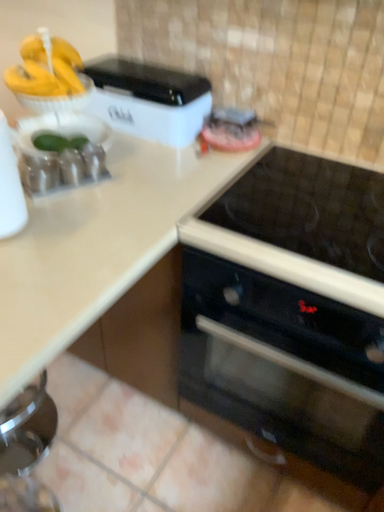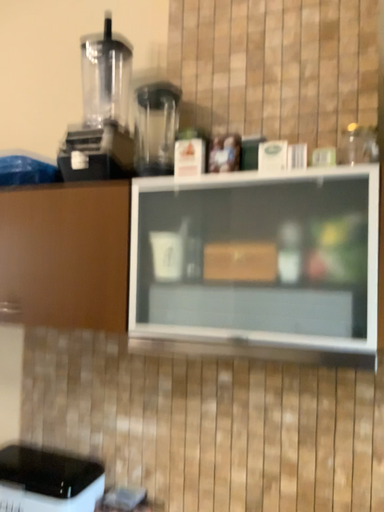
Question: Which way did the camera rotate in the video?

Choices:
 (A) rotated upward
 (B) rotated downward

Answer: (A)